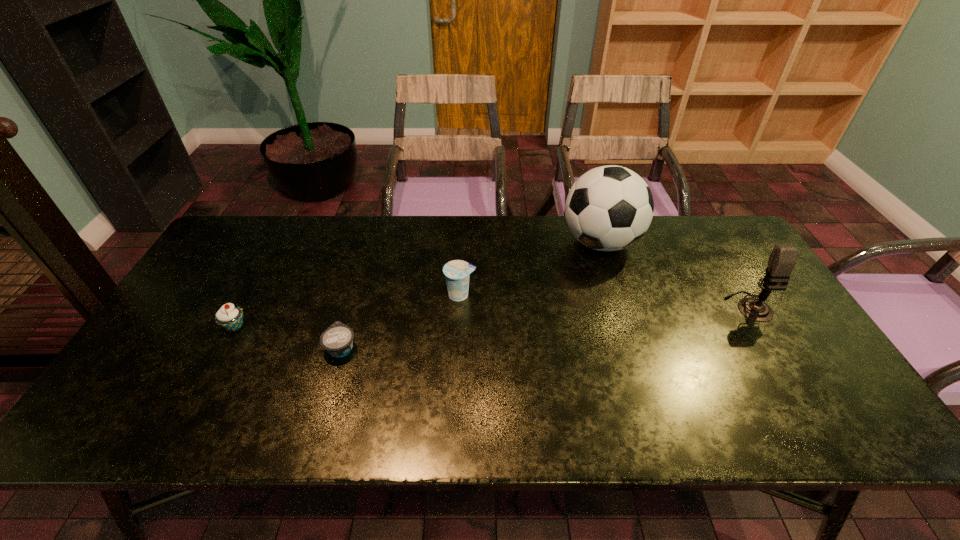
This screenshot has height=540, width=960. Identify the location of vacant space at the far left corner of the desktop. (266, 228).

You are a GUI agent. You are given a task and a screenshot of the screen. Output one action in this format:
    pyautogui.click(x=<x>, y=<y>)
    Task: Click on the free space at the far right corner of the desktop
    
    Given the screenshot: What is the action you would take?
    pyautogui.click(x=726, y=232)

Where is `free point between the second object from left to right and the fourth object from left to right`? The height and width of the screenshot is (540, 960). free point between the second object from left to right and the fourth object from left to right is located at coordinates (471, 295).

Locate an element on the screen. The image size is (960, 540). vacant area between the soccer ball and the second tallest object is located at coordinates (675, 274).

You are a GUI agent. You are given a task and a screenshot of the screen. Output one action in this format:
    pyautogui.click(x=<x>, y=<y>)
    Task: Click on the free spot between the tallest object and the cupcake
    This screenshot has width=960, height=540.
    Given the screenshot: What is the action you would take?
    pyautogui.click(x=418, y=285)

Find the location of a particular element. The image size is (960, 540). vacant region between the second tallest object and the leftmost object is located at coordinates (492, 316).

Where is `free space between the cupcake and the shortest object`? free space between the cupcake and the shortest object is located at coordinates (288, 337).

You are a GUI agent. You are given a task and a screenshot of the screen. Output one action in this format:
    pyautogui.click(x=<x>, y=<y>)
    Task: Click on the free area in between the right yogurt and the second tallest object
    The image size is (960, 540).
    Given the screenshot: What is the action you would take?
    pyautogui.click(x=605, y=301)

The width and height of the screenshot is (960, 540). What are the coordinates of `free space between the microphone and the shorter yogurt` in the screenshot? It's located at (545, 327).

Locate an element on the screen. vacant space that is in between the rightmost object and the farthest object is located at coordinates (675, 274).